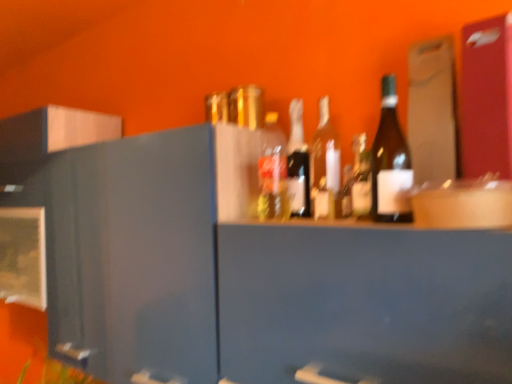
Locate an element on the screen. vacant space to the left of green glass bottle at upper right, positioned as the sixth bottle in back-to-front order is located at coordinates (323, 225).